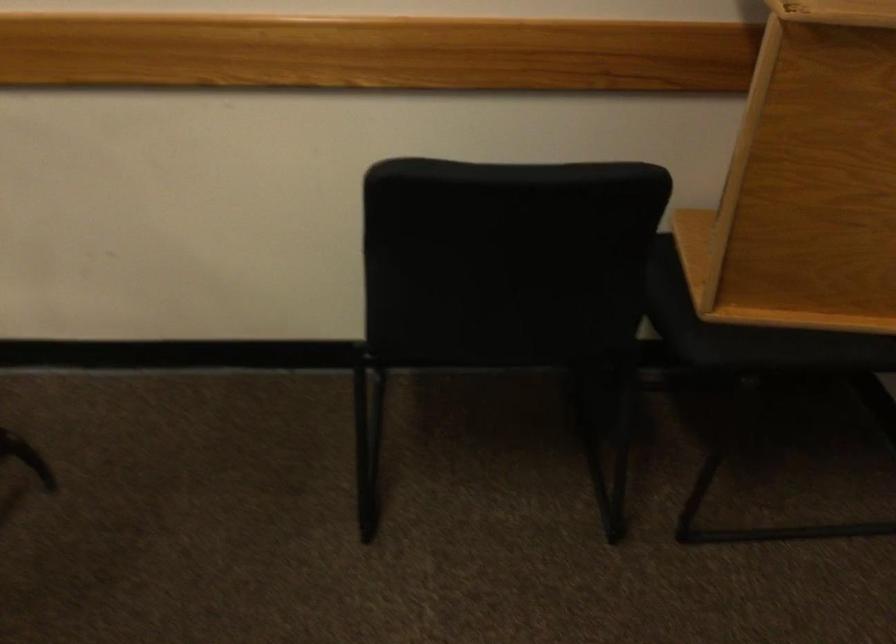
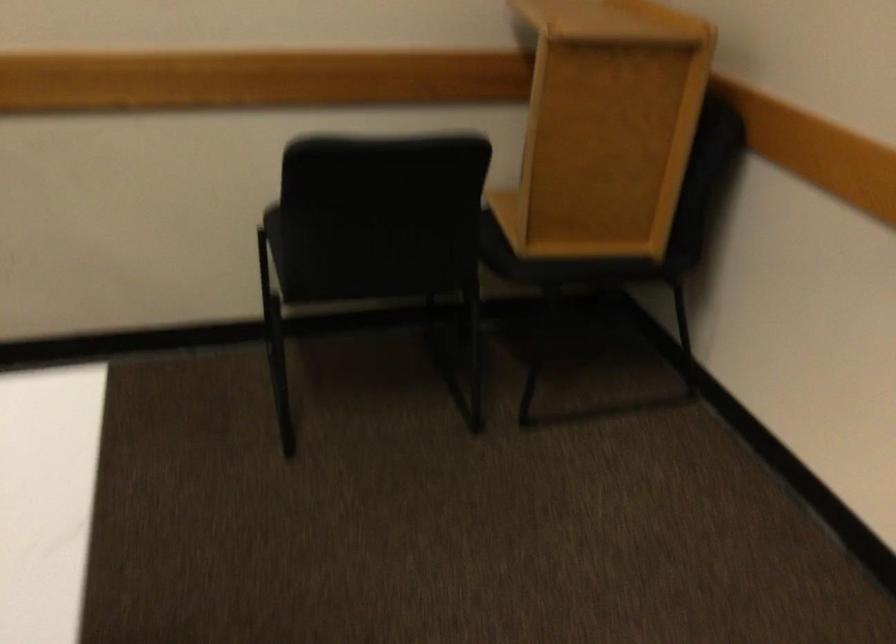
Locate, in the second image, the point that corresponds to point (452, 304) in the first image.

(348, 250)